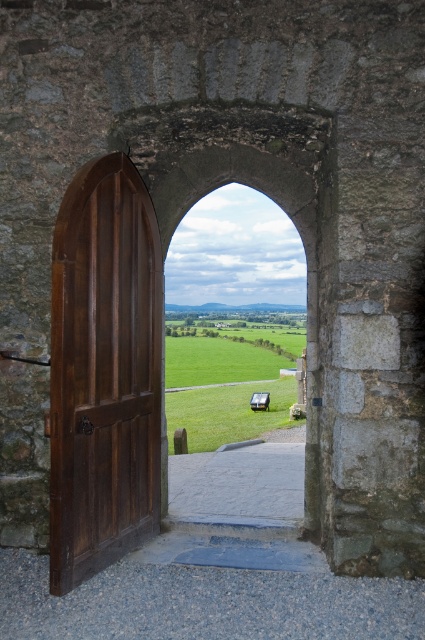
Does point (81, 577) lie in front of point (175, 369)?

Yes, it is.

Describe the element at coordinates (104, 371) in the screenshot. The height and width of the screenshot is (640, 425). I see `polished dark wood door at left` at that location.

Between point (159, 356) and point (201, 360), which one is positioned behind?

The point (201, 360) is more distant.

Locate an element on the screen. polished dark wood door at left is located at coordinates (104, 371).